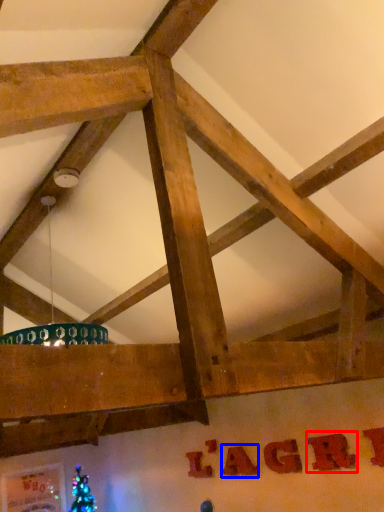
Question: Among these objects, which one is farthest to the camera, letter (highlighted by a red box) or letter (highlighted by a blue box)?

Choices:
 (A) letter
 (B) letter

Answer: (B)